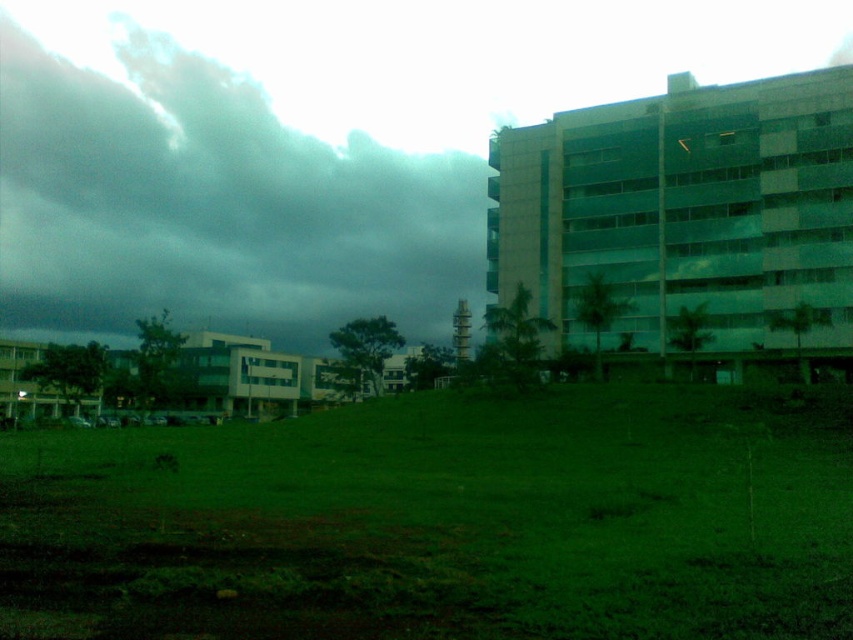
Question: Does green grassy field at lower center appear over dark gray cloud at upper left?

Choices:
 (A) no
 (B) yes

Answer: (A)

Question: Is green grassy field at lower center smaller than dark gray cloud at upper left?

Choices:
 (A) yes
 (B) no

Answer: (A)

Question: Which object appears closest to the camera in this image?

Choices:
 (A) green grassy field at lower center
 (B) dark gray cloud at upper left

Answer: (A)

Question: Is the position of green grassy field at lower center less distant than that of dark gray cloud at upper left?

Choices:
 (A) no
 (B) yes

Answer: (B)